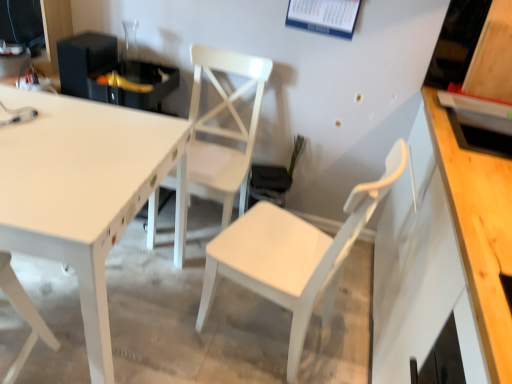
Question: Is white matte chair at center, which ranks as the first chair in right-to-left order, closer to the viewer compared to white matte chair at lower left, which appears as the 1th chair when viewed from the left?

Choices:
 (A) yes
 (B) no

Answer: (B)

Question: From a real-world perspective, is white matte chair at center, which ranks as the first chair in right-to-left order, physically below white matte chair at lower left, which appears as the 1th chair when viewed from the left?

Choices:
 (A) no
 (B) yes

Answer: (A)

Question: Can you confirm if white matte chair at center, which is counted as the 3th chair, starting from the left, is wider than white matte chair at lower left, which appears as the 3th chair when viewed from the right?

Choices:
 (A) no
 (B) yes

Answer: (B)

Question: Is white matte chair at center, which is counted as the 3th chair, starting from the left, positioned behind white matte chair at lower left, which appears as the 3th chair when viewed from the right?

Choices:
 (A) yes
 (B) no

Answer: (A)

Question: Can you confirm if white matte chair at center, which is counted as the 3th chair, starting from the left, is thinner than white matte chair at lower left, which appears as the 1th chair when viewed from the left?

Choices:
 (A) yes
 (B) no

Answer: (B)

Question: Based on their positions, is white matte chair at center, which is counted as the 3th chair, starting from the left, located to the left or right of white glossy table at upper left?

Choices:
 (A) left
 (B) right

Answer: (B)

Question: Looking at the image, does white matte chair at center, which is counted as the 3th chair, starting from the left, seem bigger or smaller compared to white glossy table at upper left?

Choices:
 (A) small
 (B) big

Answer: (A)

Question: From the image's perspective, relative to white glossy table at upper left, is white matte chair at center, which ranks as the first chair in right-to-left order, above or below?

Choices:
 (A) below
 (B) above

Answer: (A)

Question: In the image, is white matte chair at center, which is counted as the 3th chair, starting from the left, positioned in front of or behind white glossy table at upper left?

Choices:
 (A) behind
 (B) front

Answer: (A)

Question: Looking at their shapes, would you say white matte chair at lower left, which appears as the 3th chair when viewed from the right, is wider or thinner than white matte chair at center, which is the 2th chair from right to left?

Choices:
 (A) wide
 (B) thin

Answer: (B)

Question: Does point (6, 377) appear closer or farther from the camera than point (187, 182)?

Choices:
 (A) closer
 (B) farther

Answer: (A)

Question: Considering the positions of white matte chair at lower left, which appears as the 3th chair when viewed from the right, and white matte chair at center, the second chair from the left, in the image, is white matte chair at lower left, which appears as the 3th chair when viewed from the right, bigger or smaller than white matte chair at center, the second chair from the left,?

Choices:
 (A) small
 (B) big

Answer: (A)

Question: From their relative heights in the image, would you say white matte chair at lower left, which appears as the 3th chair when viewed from the right, is taller or shorter than white matte chair at center, the second chair from the left?

Choices:
 (A) short
 (B) tall

Answer: (A)

Question: Based on their positions, is white matte chair at lower left, which appears as the 1th chair when viewed from the left, located to the left or right of white glossy table at upper left?

Choices:
 (A) left
 (B) right

Answer: (B)

Question: Considering the positions of white matte chair at lower left, which appears as the 1th chair when viewed from the left, and white glossy table at upper left in the image, is white matte chair at lower left, which appears as the 1th chair when viewed from the left, taller or shorter than white glossy table at upper left?

Choices:
 (A) short
 (B) tall

Answer: (B)